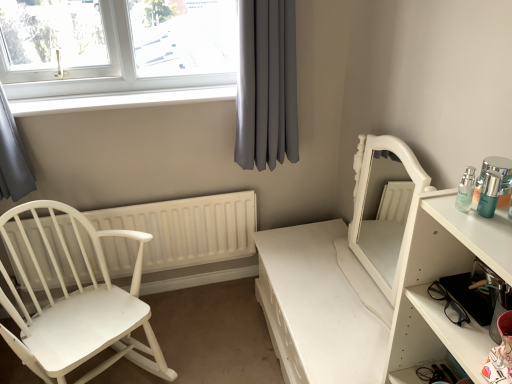
Locate an element on the screen. The height and width of the screenshot is (384, 512). free point below white glossy mirror at right (from a real-world perspective) is located at coordinates (360, 273).